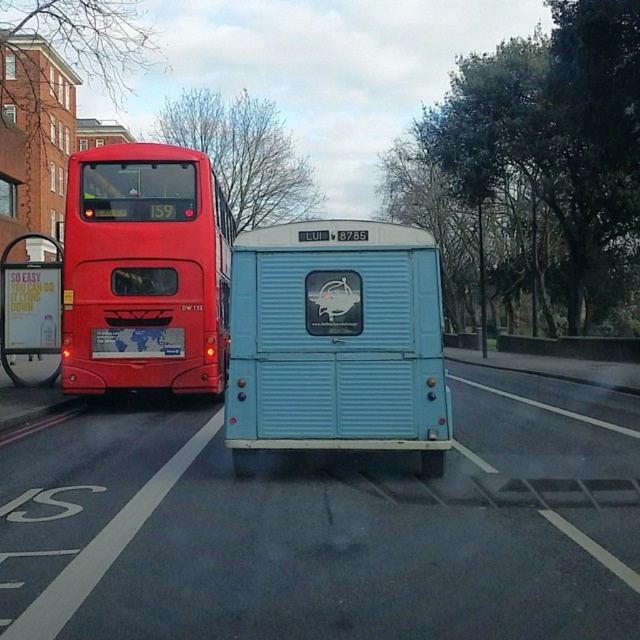
You are a pedestrian standing at point (145, 272). You want to cross the street to reach the light blue van. Is the red double decker bus blocking your path?

The point (145, 272) is on the matte red bus at left, so the red double decker bus is blocking your path to the light blue van.

You are a pedestrian standing on the sidewalk and see the matte red bus at left and the white plastic license plate at rear center. Which object is nearer to you?

The matte red bus at left is closer to the viewer than the white plastic license plate at rear center.

You are a delivery person who needs to park your vehicle between the matte red bus at left and the white plastic sign at left. Can your vehicle, which is 2 meters wide, fit in the space between them?

The matte red bus at left has a lesser width compared to white plastic sign at left. However, the exact width of the space between them isn t specified in the objects description. Therefore, it s uncertain whether a 2 meter wide vehicle can fit there.